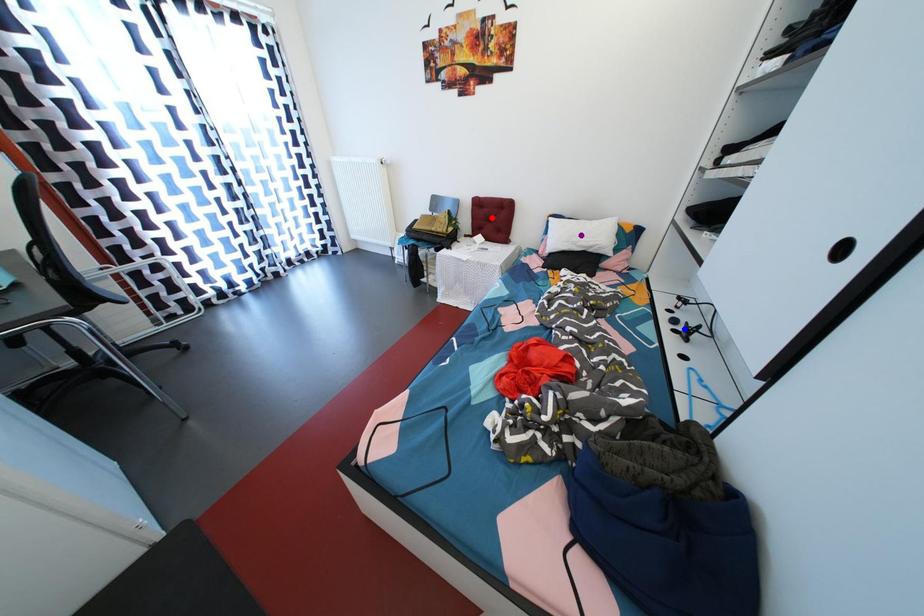
From the picture: Order these from nearest to farthest:
purple point | blue point | red point

red point < purple point < blue point